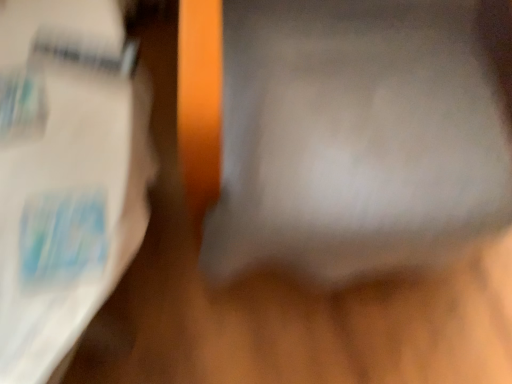
What do you see at coordinates (66, 174) in the screenshot?
I see `white paper at upper left` at bounding box center [66, 174].

Identify the location of white paper at upper left. (66, 174).

This screenshot has width=512, height=384. Identify the location of white paper at upper left. (66, 174).